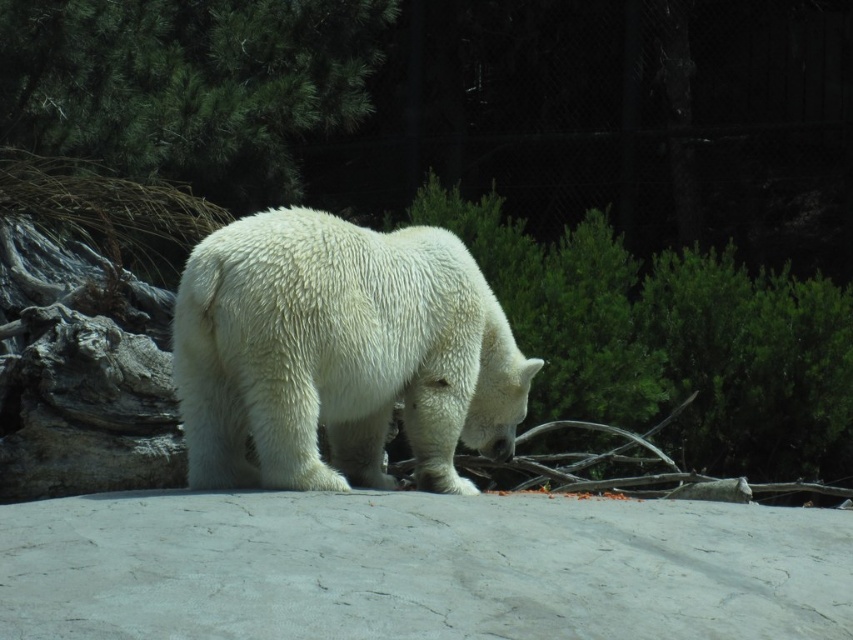
Question: Which object is farther from the camera taking this photo?

Choices:
 (A) green textured pine tree at upper left
 (B) white fluffy bear at center

Answer: (A)

Question: Is white fluffy bear at center positioned in front of green textured pine tree at upper left?

Choices:
 (A) no
 (B) yes

Answer: (B)

Question: Is white fluffy bear at center further to the viewer compared to green textured pine tree at upper left?

Choices:
 (A) no
 (B) yes

Answer: (A)

Question: Does white fluffy bear at center appear on the left side of green textured pine tree at upper left?

Choices:
 (A) no
 (B) yes

Answer: (A)

Question: Which point is closer to the camera?

Choices:
 (A) green textured pine tree at upper left
 (B) white fluffy bear at center

Answer: (B)